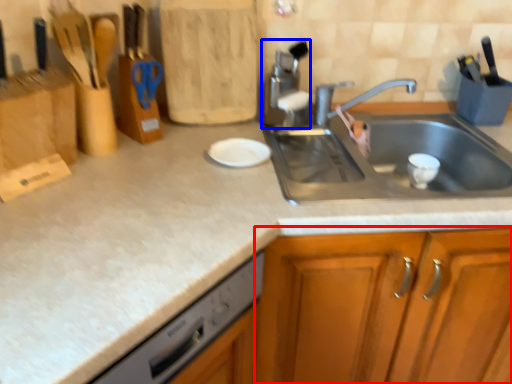
Question: Among these objects, which one is nearest to the camera, cabinetry (highlighted by a red box) or appliance (highlighted by a blue box)?

Choices:
 (A) cabinetry
 (B) appliance

Answer: (A)